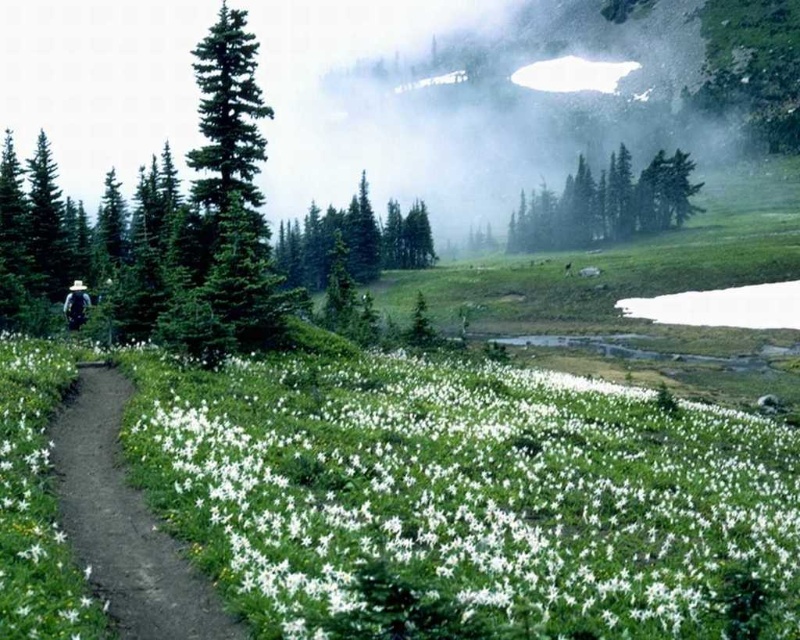
Question: Which point is farther to the camera?

Choices:
 (A) dirt path at left
 (B) white matte flower at lower center
 (C) green glossy evergreen tree at center
 (D) green matte trees at upper center

Answer: (D)

Question: Which of the following is the farthest from the observer?

Choices:
 (A) (308, 225)
 (B) (260, 312)
 (C) (454, 593)
 (D) (572, 198)

Answer: (D)

Question: Is green glossy evergreen tree at center to the left of green matte tree at center from the viewer's perspective?

Choices:
 (A) yes
 (B) no

Answer: (B)

Question: Among these objects, which one is farthest from the camera?

Choices:
 (A) dirt path at left
 (B) green matte trees at upper center

Answer: (B)

Question: Can you confirm if white matte flower at lower center is positioned above green glossy evergreen tree at center?

Choices:
 (A) yes
 (B) no

Answer: (B)

Question: Is green glossy evergreen tree at center positioned before green matte tree at center?

Choices:
 (A) yes
 (B) no

Answer: (A)